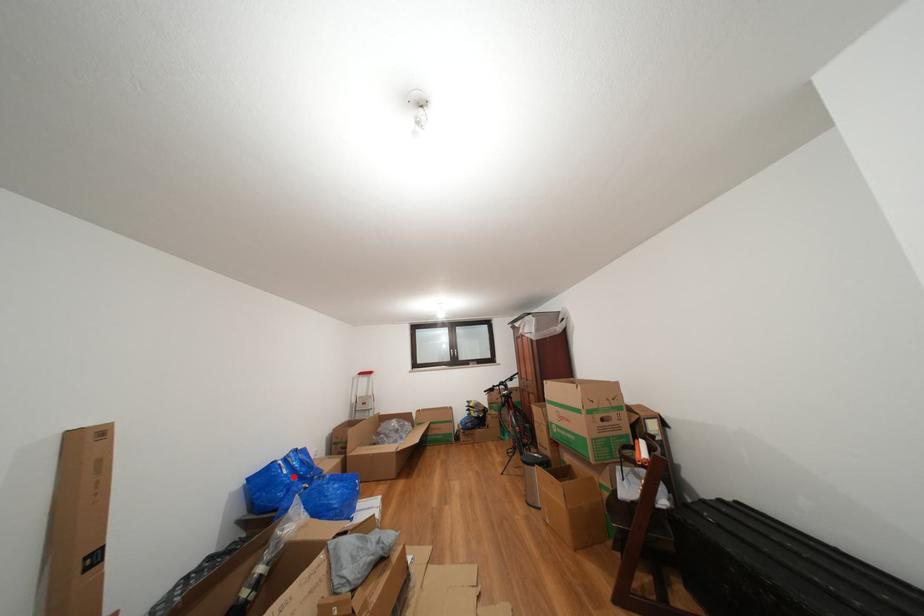
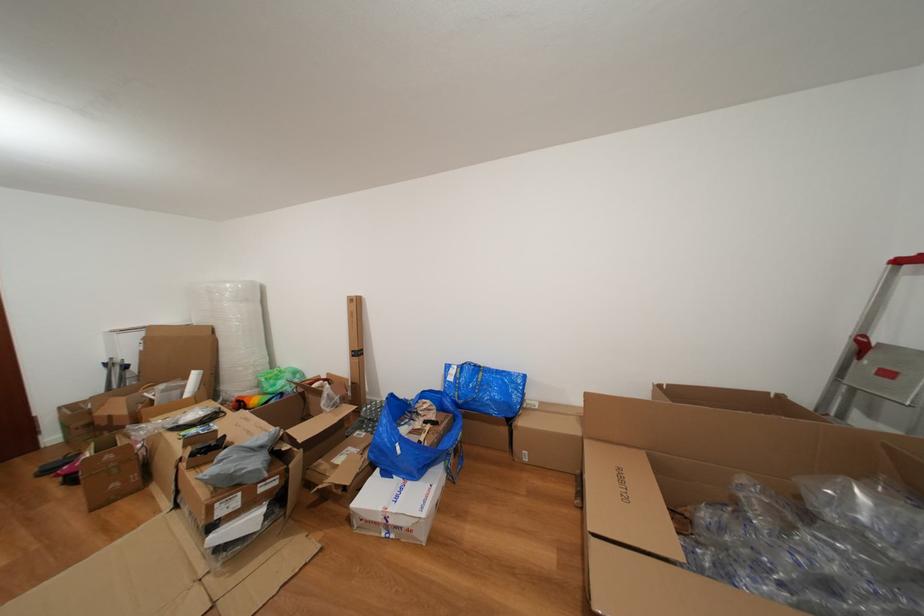
Question: I am providing you with two images of the same scene from different viewpoints. Given a red point in image1, look at the same physical point in image2. Is it:

Choices:
 (A) Closer to the viewpoint
 (B) Farther from the viewpoint

Answer: (B)